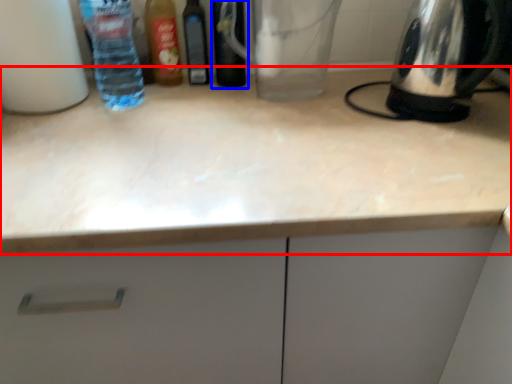
Question: Among these objects, which one is farthest to the camera, countertop (highlighted by a red box) or bottle (highlighted by a blue box)?

Choices:
 (A) countertop
 (B) bottle

Answer: (B)